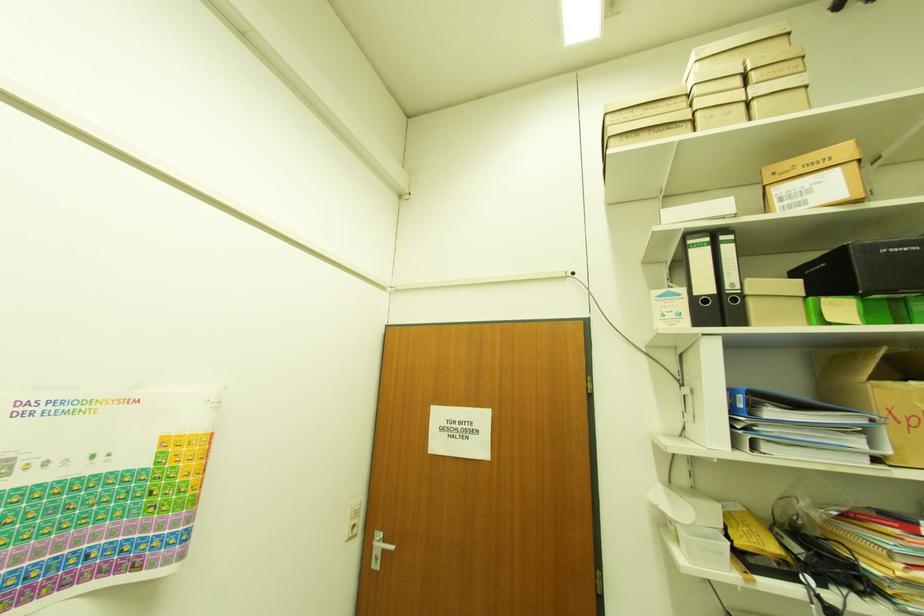
The width and height of the screenshot is (924, 616). Find the location of `white power socket`. white power socket is located at coordinates (353, 525).